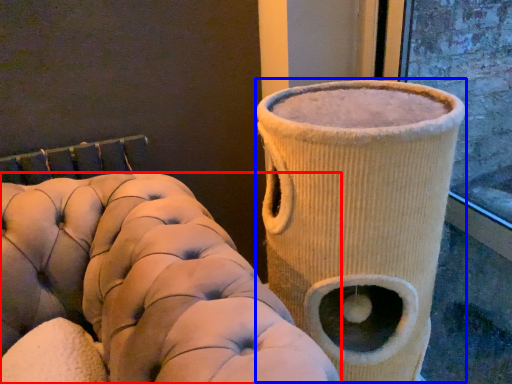
Question: Which of the following is the farthest to the observer, furniture (highlighted by a red box) or vase (highlighted by a blue box)?

Choices:
 (A) furniture
 (B) vase

Answer: (B)